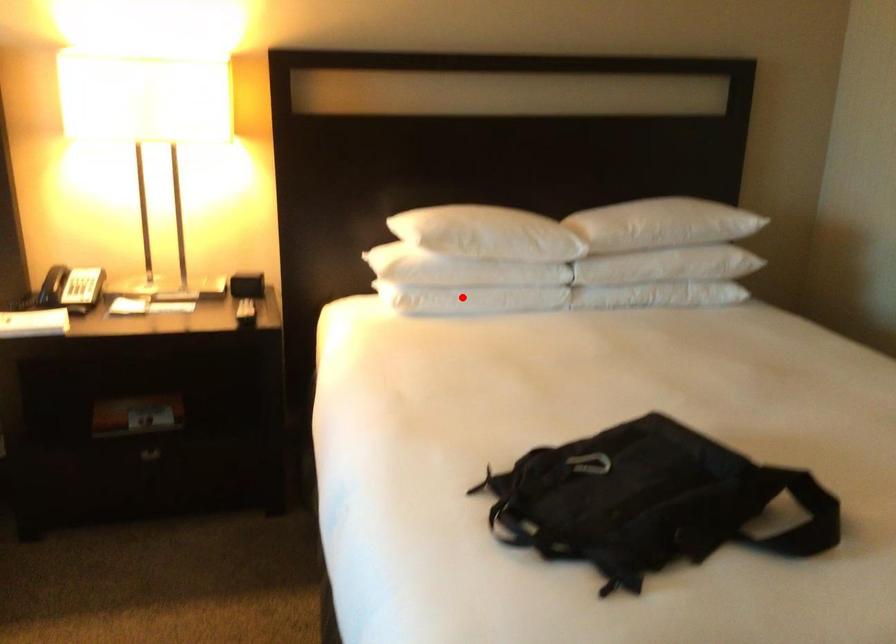
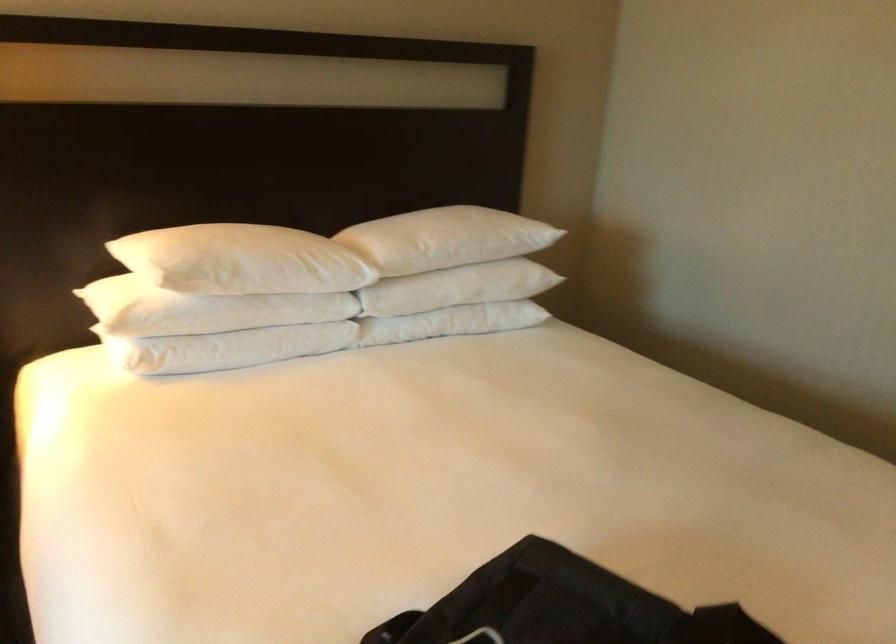
Question: I am providing you with two images of the same scene from different viewpoints. Image1 has a red point marked. In image2, the corresponding 3D location appears at what relative position? Reply with the corresponding letter.

Choices:
 (A) Closer
 (B) Farther

Answer: (A)